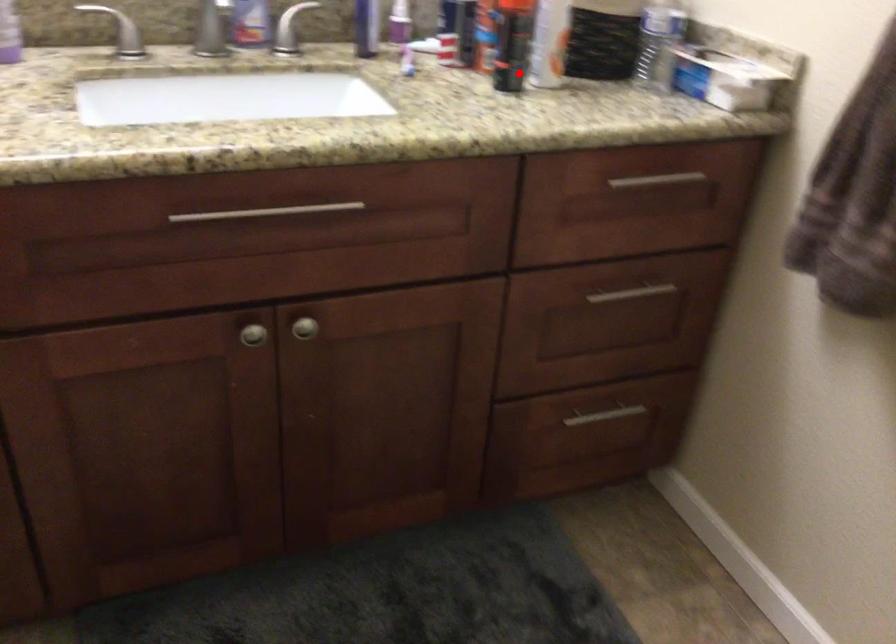
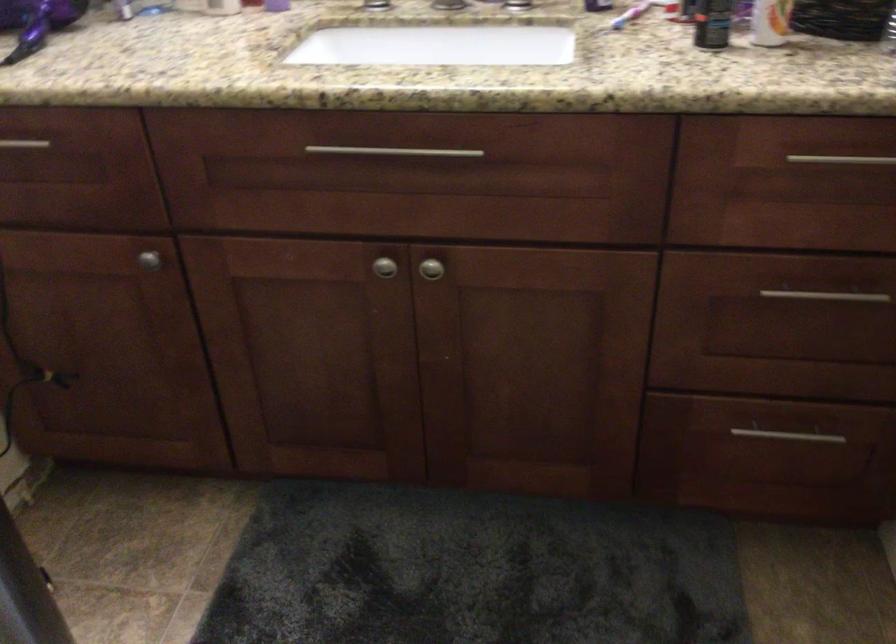
Question: I am providing you with two images of the same scene from different viewpoints. A red point is shown in image1. For the corresponding object point in image2, is it positioned nearer or farther from the camera?

Choices:
 (A) Nearer
 (B) Farther

Answer: (A)